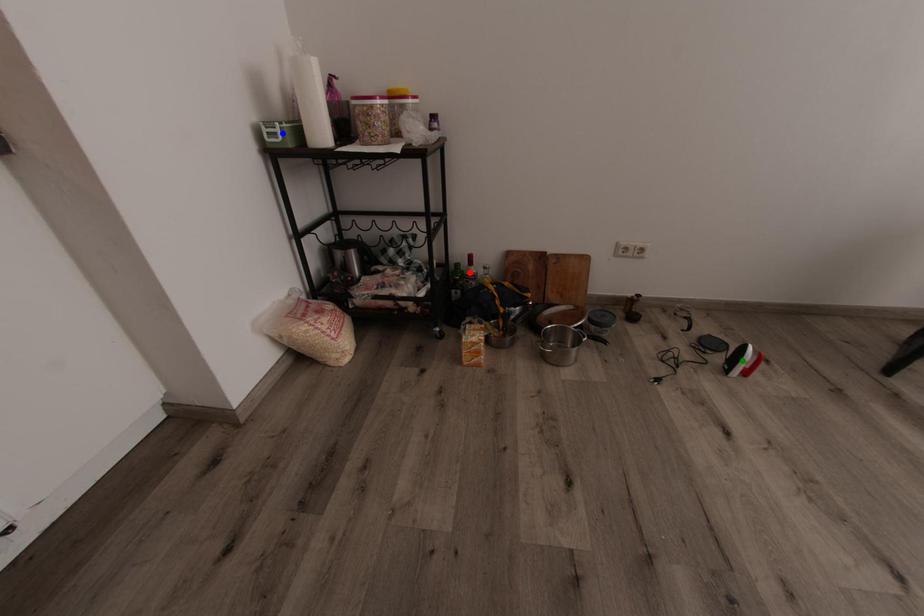
Order these from farthest to nearest:
blue point | red point | green point

red point → green point → blue point